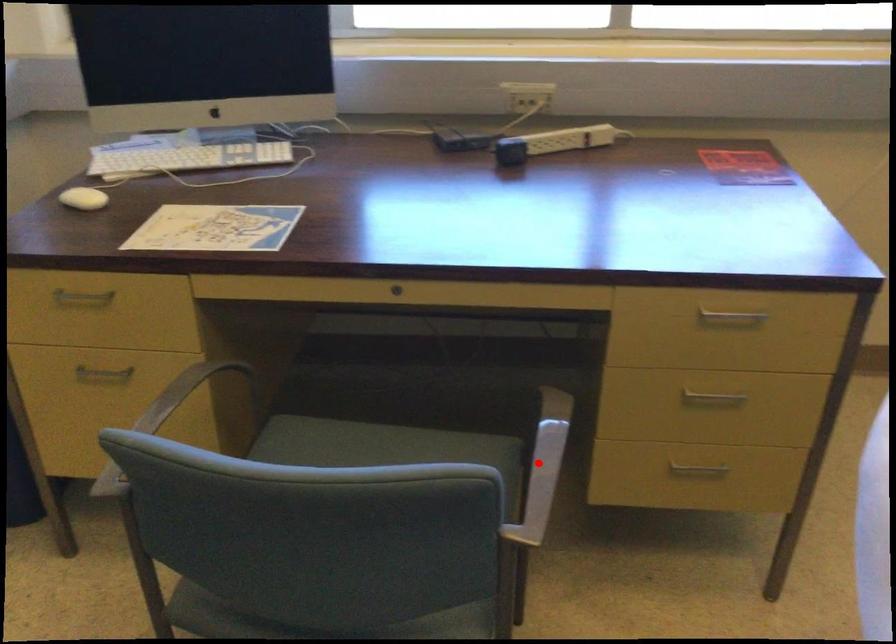
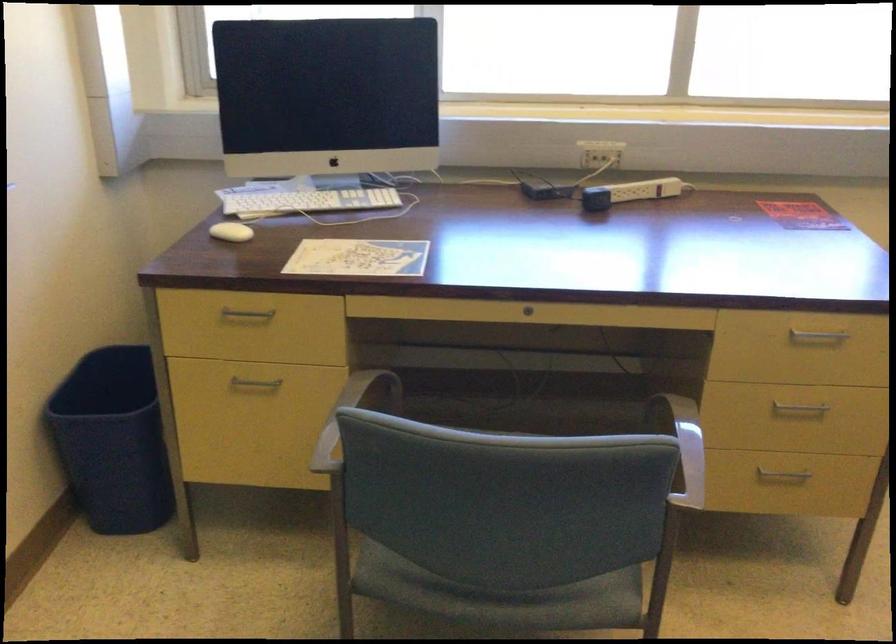
Question: I am providing you with two images of the same scene from different viewpoints. In image1, a red point is highlighted. Considering the same 3D point in image2, which of the following is correct?

Choices:
 (A) It is closer
 (B) It is farther

Answer: (B)